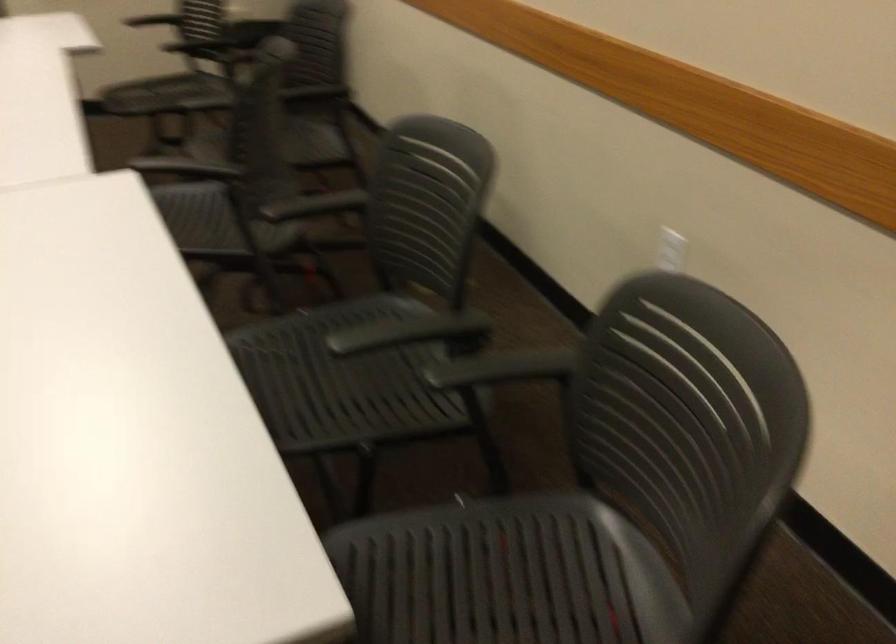
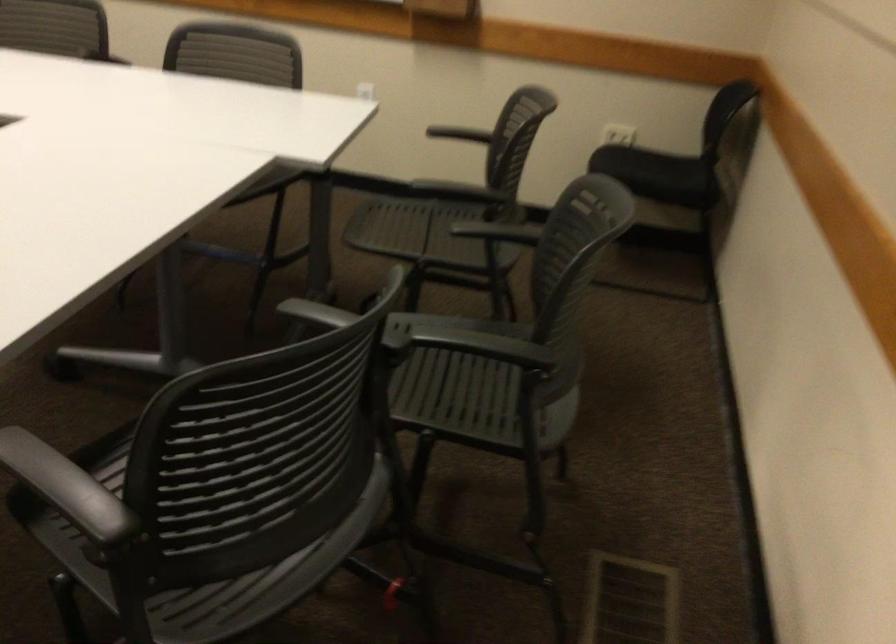
Where in the second image is the point corresponding to the point at 231,134 from the first image?

(141, 440)